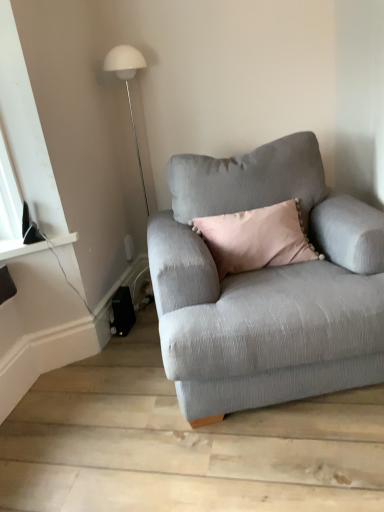
Measure the distance between suede gray couch at center and camera.

suede gray couch at center and camera are 1.35 meters apart from each other.

What do you see at coordinates (266, 286) in the screenshot? The height and width of the screenshot is (512, 384). I see `suede gray couch at center` at bounding box center [266, 286].

This screenshot has height=512, width=384. I want to click on suede gray couch at center, so click(x=266, y=286).

Where is `suede gray couch at center`? suede gray couch at center is located at coordinates (266, 286).